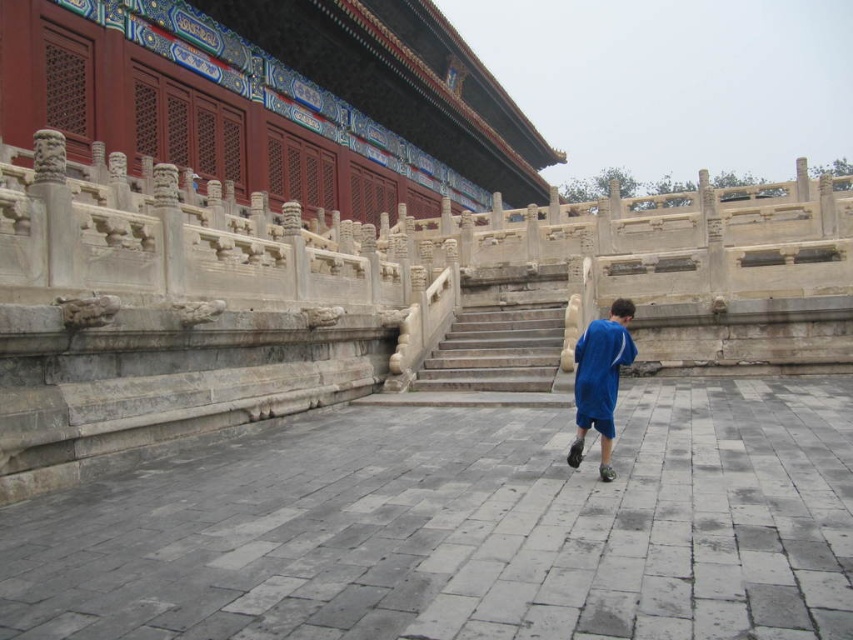
Does stone stairs at center have a larger size compared to blue fabric shorts at center?

Actually, stone stairs at center might be smaller than blue fabric shorts at center.

Is the position of stone stairs at center more distant than that of blue fabric shorts at center?

Yes.

Image resolution: width=853 pixels, height=640 pixels. Identify the location of stone stairs at center. (496, 349).

Image resolution: width=853 pixels, height=640 pixels. In order to click on stone stairs at center in this screenshot , I will do `click(496, 349)`.